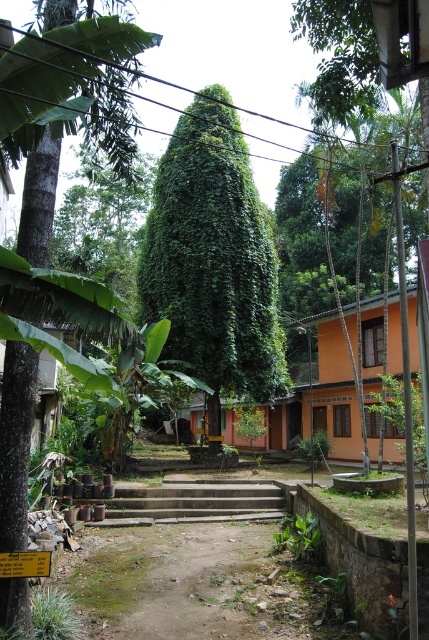
Question: Which point is farther to the camera?

Choices:
 (A) (186, 116)
 (B) (217, 486)
 (C) (9, 458)

Answer: (A)

Question: Which of the following is the closest to the observer?

Choices:
 (A) (211, 515)
 (B) (259, 244)
 (C) (57, 1)

Answer: (C)

Question: Which point is farther from the camera taking this photo?

Choices:
 (A) (24, 504)
 (B) (126, 499)
 (C) (193, 356)

Answer: (C)

Question: Does green leafy tree at center appear on the right side of concrete stairs at center?

Choices:
 (A) yes
 (B) no

Answer: (B)

Question: Does green leafy tree at center appear on the right side of concrete stairs at center?

Choices:
 (A) yes
 (B) no

Answer: (B)

Question: Can you confirm if green leafy tree at center is smaller than concrete stairs at center?

Choices:
 (A) yes
 (B) no

Answer: (B)